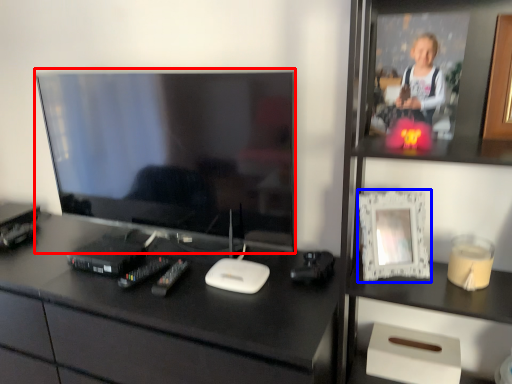
Question: Which of the following is the closest to the observer, television (highlighted by a red box) or picture frame (highlighted by a blue box)?

Choices:
 (A) television
 (B) picture frame

Answer: (B)